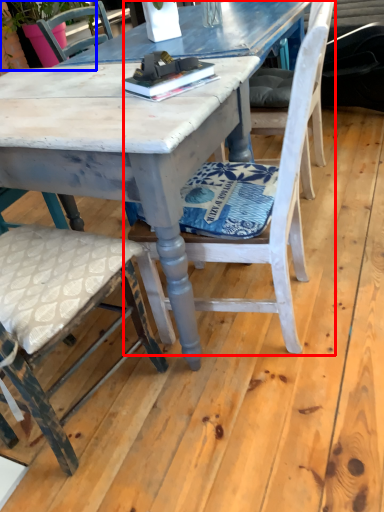
Question: Which object appears closest to the camera in this image, chair (highlighted by a red box) or plant (highlighted by a blue box)?

Choices:
 (A) chair
 (B) plant

Answer: (A)